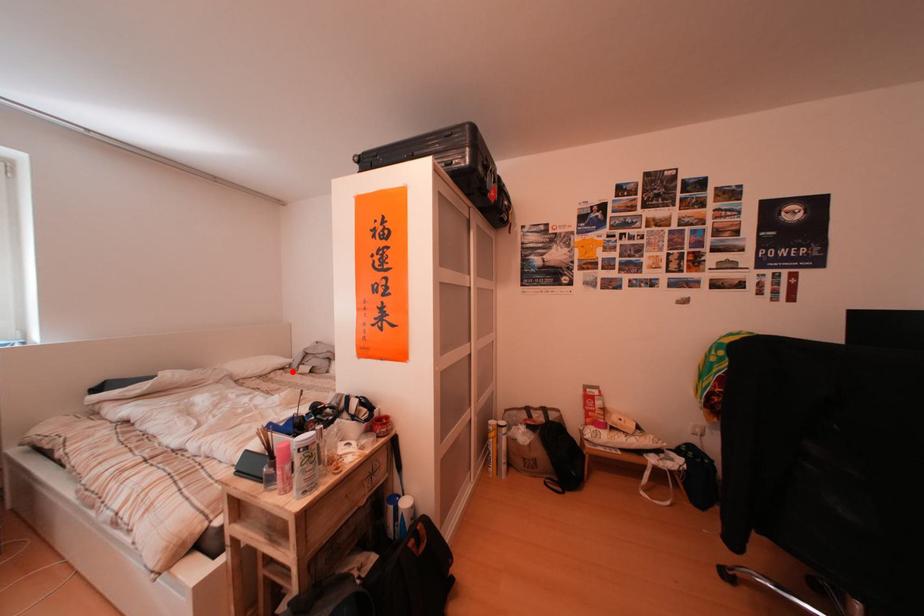
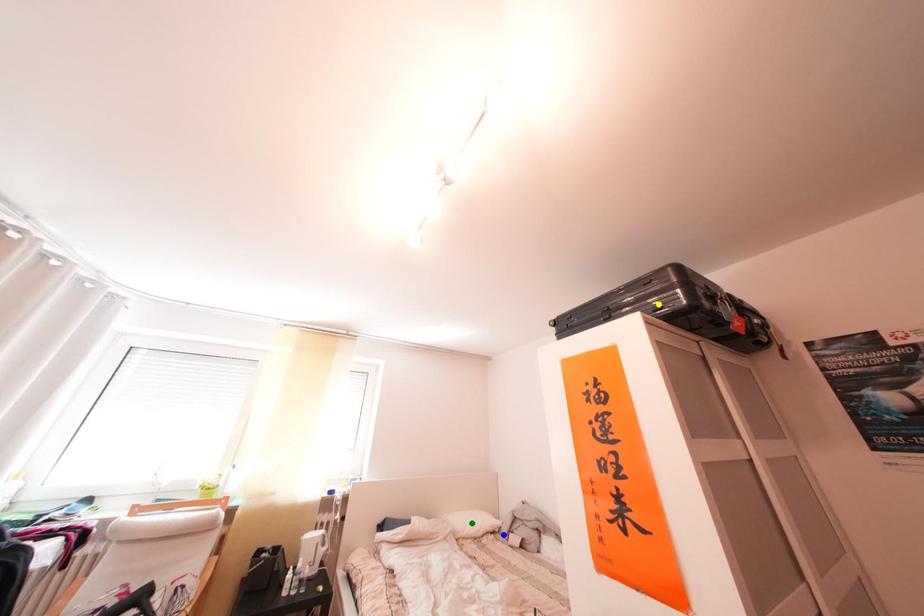
Question: I am providing you with two images of the same scene from different viewpoints. A red point is marked on the first image. You are given multiple points on the second image. Which point in image 2 represents the same 3d spot as the red point in image 1?

Choices:
 (A) blue point
 (B) yellow point
 (C) green point

Answer: (A)